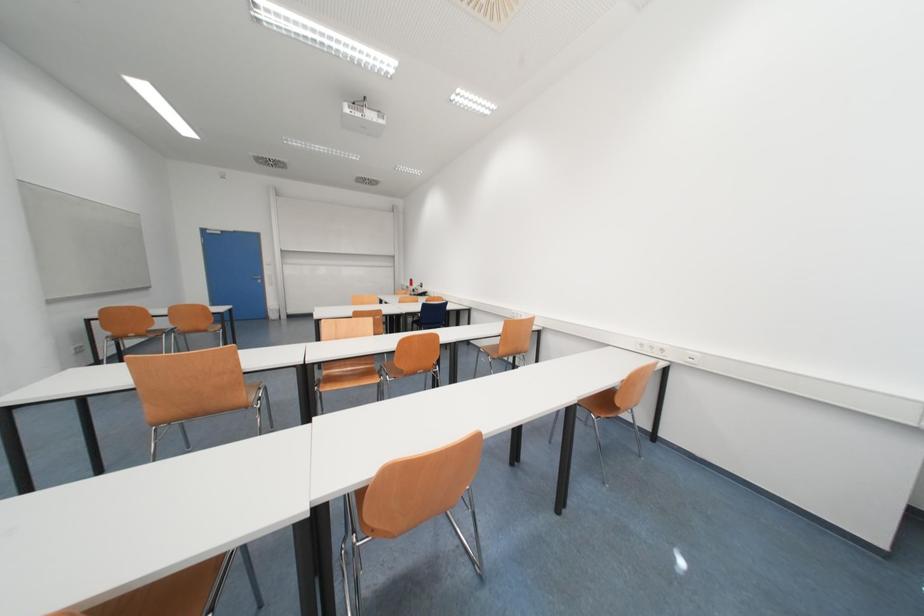
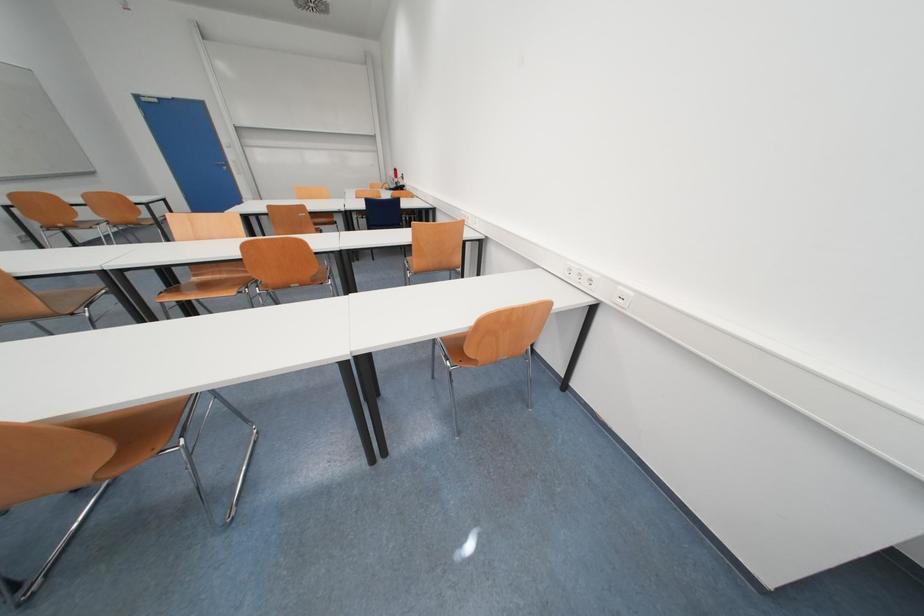
In a continuous first-person perspective shot, in which direction is the camera moving?

The movement direction of the cameraman is right, forward.